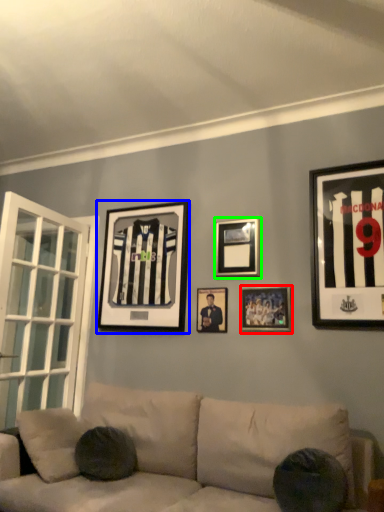
Question: Estimate the real-world distances between objects in this image. Which object is farther from picture frame (highlighted by a red box), picture frame (highlighted by a blue box) or picture frame (highlighted by a green box)?

Choices:
 (A) picture frame
 (B) picture frame

Answer: (A)